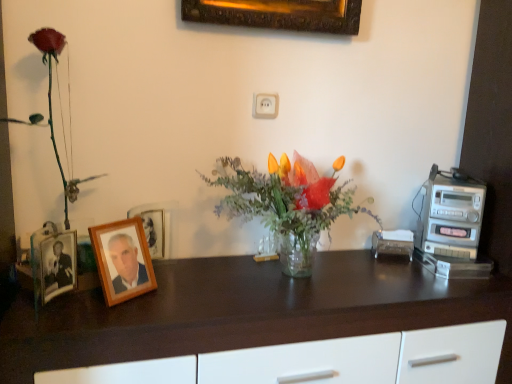
Find the location of a particular element. This screenshot has width=512, height=384. vacant space behind wooden photo frame at left, the first picture frame when ordered from front to back is located at coordinates (176, 272).